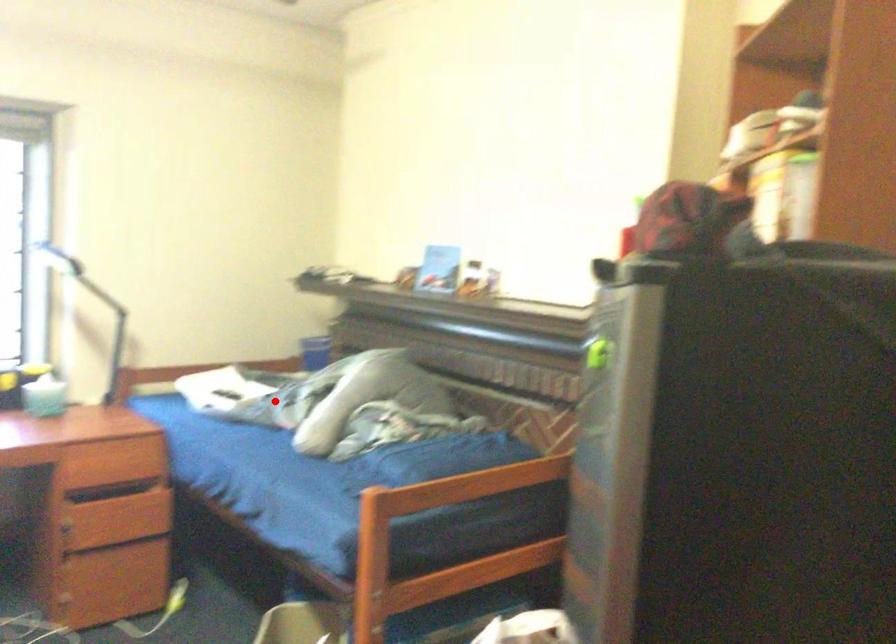
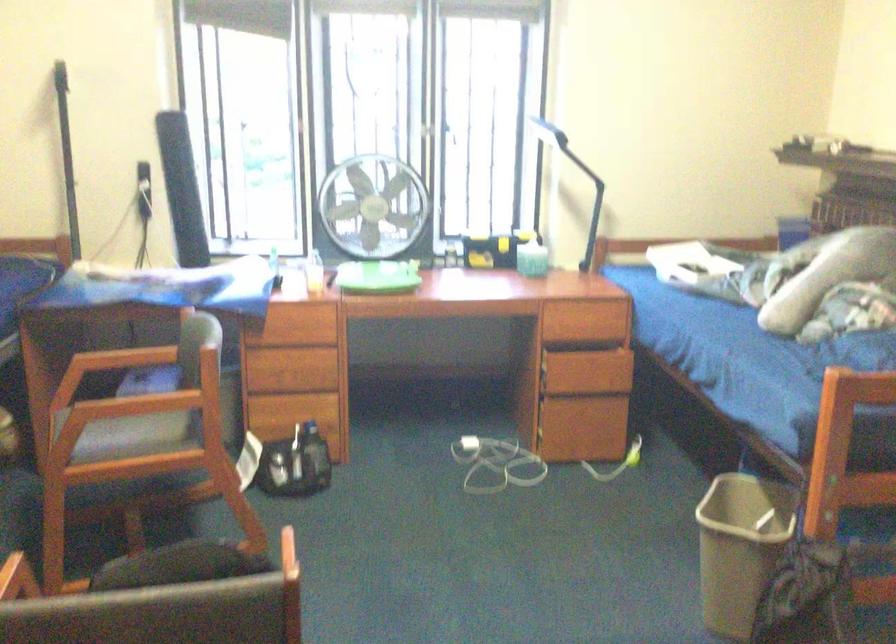
The point at the highlighted location is marked in the first image. Where is the corresponding point in the second image?

(745, 275)